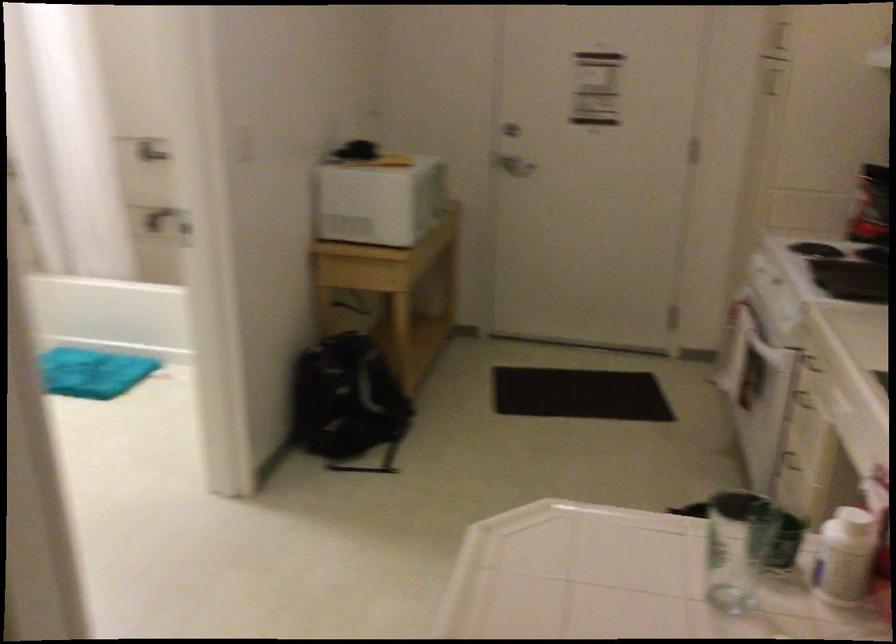
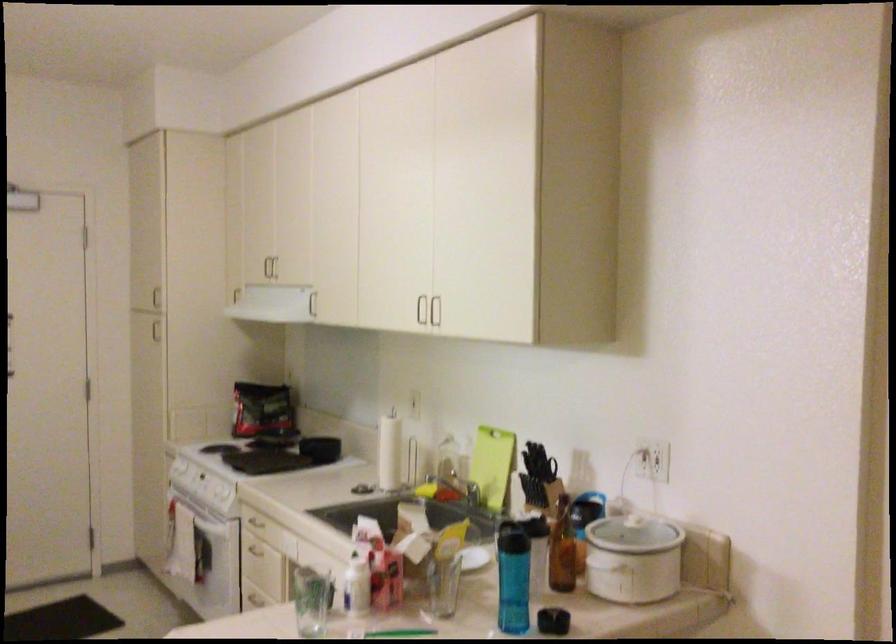
Question: How did the camera likely rotate?

Choices:
 (A) Left
 (B) Right
 (C) Up
 (D) Down

Answer: (B)